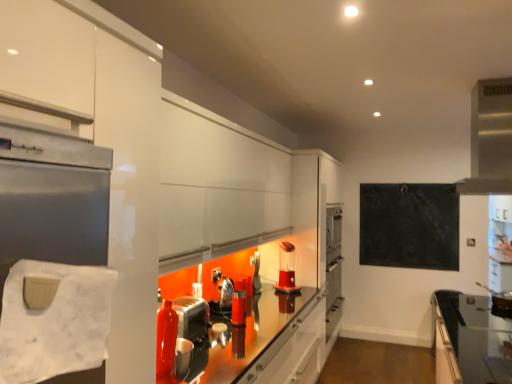
Question: Considering the relative positions of black glass countertop at lower right and satin silver exhaust hood at upper right in the image provided, is black glass countertop at lower right in front of satin silver exhaust hood at upper right?

Choices:
 (A) no
 (B) yes

Answer: (B)

Question: Considering the relative sizes of black glass countertop at lower right and satin silver exhaust hood at upper right in the image provided, is black glass countertop at lower right bigger than satin silver exhaust hood at upper right?

Choices:
 (A) no
 (B) yes

Answer: (B)

Question: From a real-world perspective, does black glass countertop at lower right stand above satin silver exhaust hood at upper right?

Choices:
 (A) no
 (B) yes

Answer: (A)

Question: Is black glass countertop at lower right facing towards satin silver exhaust hood at upper right?

Choices:
 (A) no
 (B) yes

Answer: (A)

Question: Is black glass countertop at lower right outside satin silver exhaust hood at upper right?

Choices:
 (A) yes
 (B) no

Answer: (A)

Question: Is black slate board at upper right spatially inside white paper towel at left, or outside of it?

Choices:
 (A) outside
 (B) inside

Answer: (A)

Question: From the image's perspective, is black slate board at upper right positioned above or below white paper towel at left?

Choices:
 (A) above
 (B) below

Answer: (B)

Question: Is point (458, 249) closer or farther from the camera than point (75, 314)?

Choices:
 (A) farther
 (B) closer

Answer: (A)

Question: From their relative heights in the image, would you say black slate board at upper right is taller or shorter than white paper towel at left?

Choices:
 (A) short
 (B) tall

Answer: (B)

Question: Is point coord(286,258) closer or farther from the camera than point coord(416,221)?

Choices:
 (A) farther
 (B) closer

Answer: (B)

Question: In the image, is translucent plastic coffee machine at center positioned in front of or behind black slate board at upper right?

Choices:
 (A) behind
 (B) front

Answer: (B)

Question: Looking at the image, does translucent plastic coffee machine at center seem bigger or smaller compared to black slate board at upper right?

Choices:
 (A) small
 (B) big

Answer: (A)

Question: From the image's perspective, is translucent plastic coffee machine at center located above or below black slate board at upper right?

Choices:
 (A) below
 (B) above

Answer: (A)

Question: Is black glass countertop at lower right to the left or to the right of metallic silver toaster at center, acting as the first appliance starting from the back, in the image?

Choices:
 (A) left
 (B) right

Answer: (B)

Question: From a real-world perspective, relative to metallic silver toaster at center, which is the third appliance from front to back, is black glass countertop at lower right vertically above or below?

Choices:
 (A) above
 (B) below

Answer: (B)